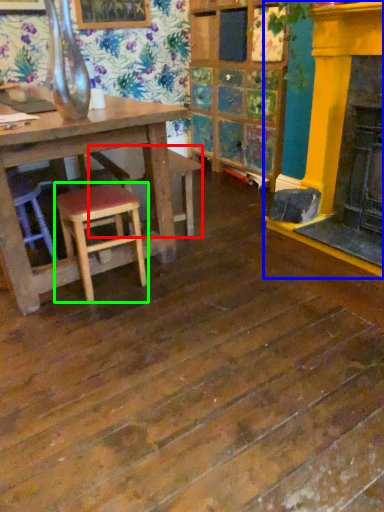
Question: Based on their relative distances, which object is nearer to bar stool (highlighted by a red box)? Choose from fireplace (highlighted by a blue box) and stool (highlighted by a green box).

Choices:
 (A) fireplace
 (B) stool

Answer: (B)